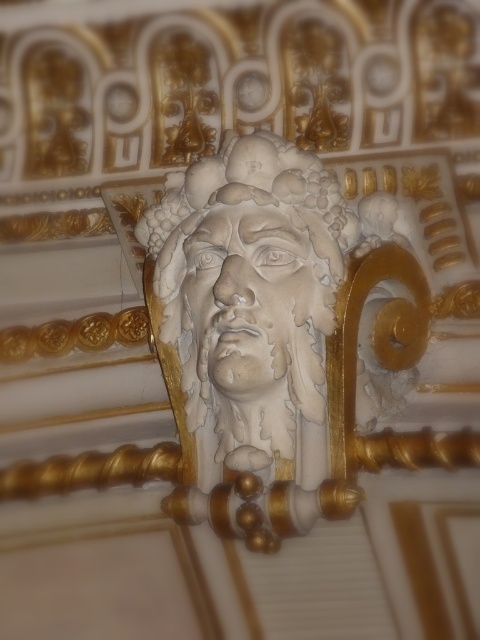
Does white stone sculpture at center appear under white stone face at center?

Yes.

Does white stone sculpture at center come behind white stone face at center?

No, it is in front of white stone face at center.

Does point (268, 433) lie in front of point (273, 328)?

No, it is behind (273, 328).

Where is `white stone sculpture at center`? The image size is (480, 640). white stone sculpture at center is located at coordinates (252, 298).